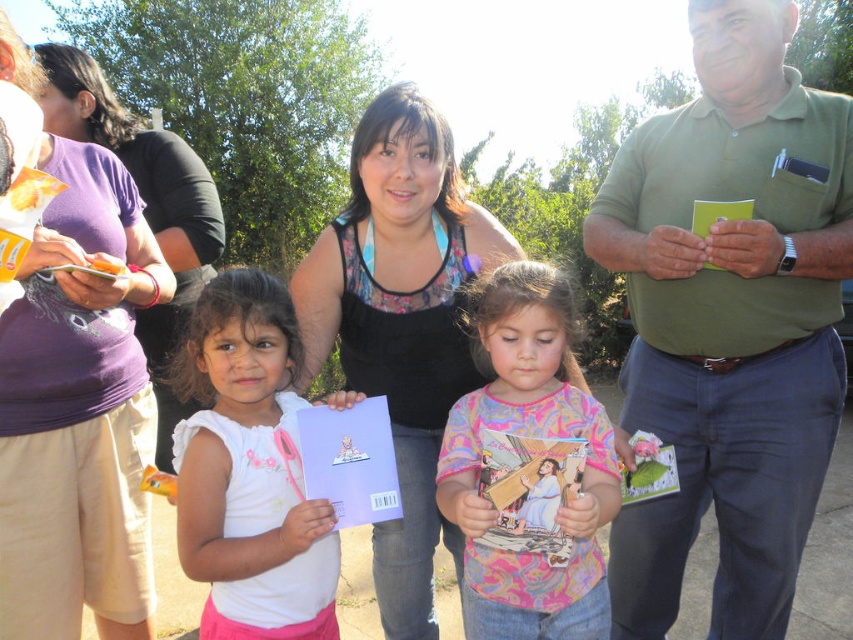
You are observing a group of people at a park. There is a green cotton shirt at center and a multicolored fabric shirt at center. Which shirt is positioned higher?

The green cotton shirt at center is positioned higher than the multicolored fabric shirt at center.

You are a photographer taking a picture of the multicolored fabric shirt at center and the white matte paper at center. Which object should you focus on first if you want to capture both in sharp focus?

You should focus on the multicolored fabric shirt at center first because it is closer to the viewer than the white matte paper at center, ensuring both will be in focus when using a shallow depth of field.